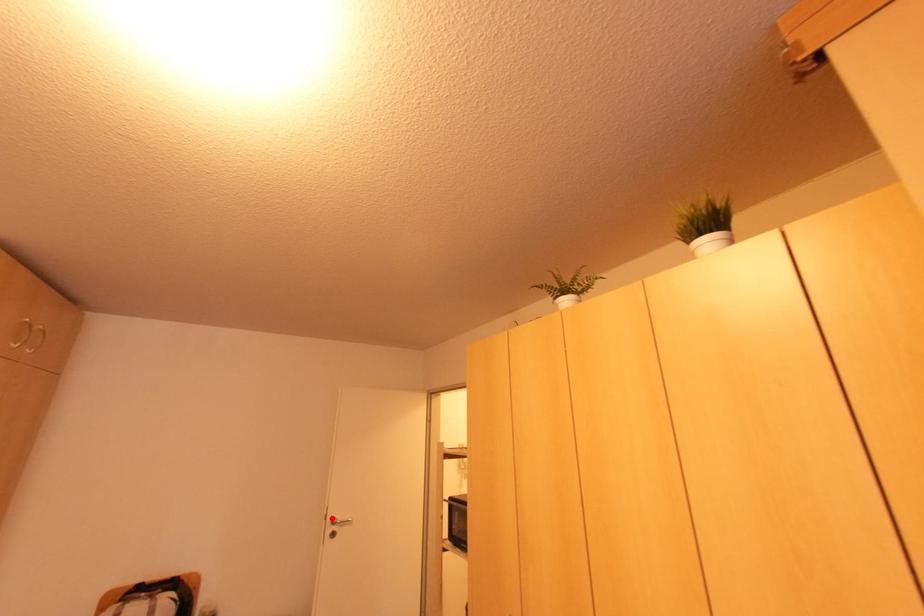
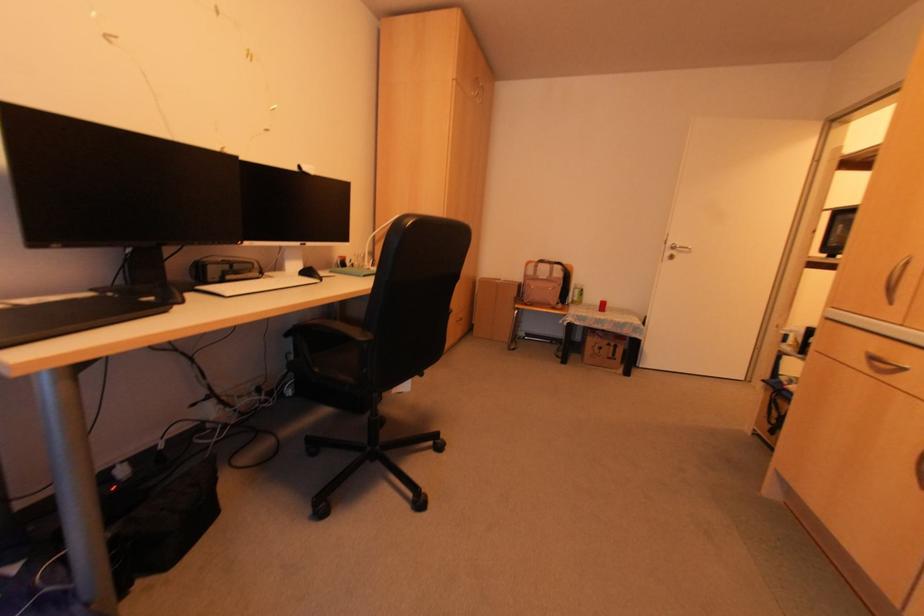
Locate, in the second image, the point that corresponds to the highlighted location in the first image.

(671, 245)